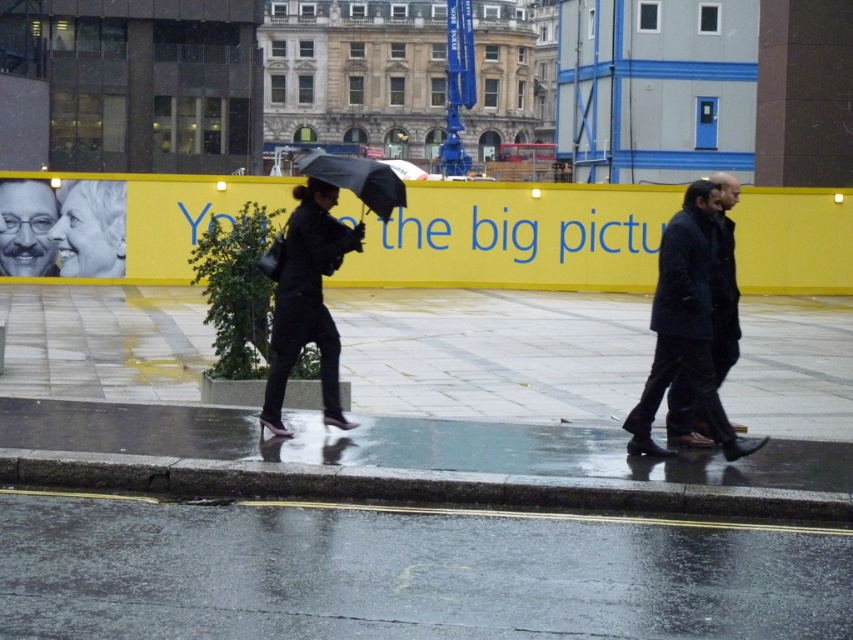
Who is more forward, (645, 524) or (39, 193)?

Point (645, 524) is in front.

Is point (84, 538) behind point (15, 192)?

No.

This screenshot has height=640, width=853. I want to click on shiny asphalt road at lower center, so click(405, 572).

Where is `shiny asphalt road at lower center`? shiny asphalt road at lower center is located at coordinates (405, 572).

Who is positioned more to the left, matte black glasses at upper left or transparent plastic umbrella at center?

matte black glasses at upper left

Does matte black glasses at upper left have a smaller size compared to transparent plastic umbrella at center?

Yes.

What do you see at coordinates (26, 227) in the screenshot?
I see `matte black glasses at upper left` at bounding box center [26, 227].

In order to click on matte black glasses at upper left in this screenshot , I will do `click(26, 227)`.

Is dark blue coat at center above matte black glasses at upper left?

Incorrect, dark blue coat at center is not positioned above matte black glasses at upper left.

Is dark blue coat at center shorter than matte black glasses at upper left?

Correct, dark blue coat at center is not as tall as matte black glasses at upper left.

Who is more distant from viewer, (x=741, y=454) or (x=10, y=259)?

Point (x=10, y=259)

Image resolution: width=853 pixels, height=640 pixels. What are the coordinates of `dark blue coat at center` in the screenshot? It's located at (685, 323).